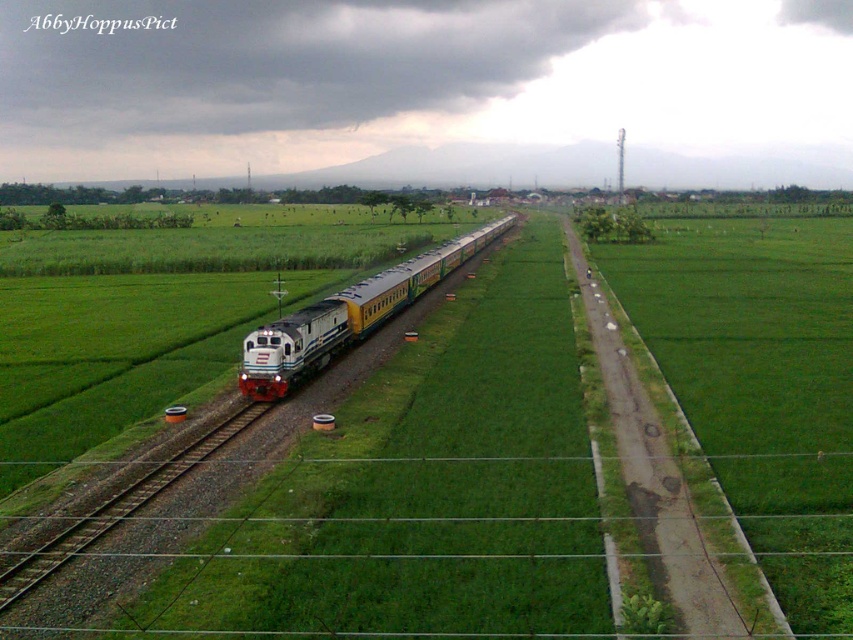
Between green grass field at center and yellow-green painted passenger train at center, which one has less height?

With less height is green grass field at center.

Consider the image. Is green grass field at center shorter than yellow-green painted passenger train at center?

Yes.

The width and height of the screenshot is (853, 640). I want to click on green grass field at center, so click(389, 493).

Who is more forward, (x=262, y=368) or (x=10, y=592)?

Point (x=10, y=592)

Is yellow-green painted passenger train at center thinner than smooth metal train track at center?

Incorrect, yellow-green painted passenger train at center's width is not less than smooth metal train track at center's.

Locate an element on the screen. The width and height of the screenshot is (853, 640). yellow-green painted passenger train at center is located at coordinates (347, 316).

Is green grass field at center shorter than smooth metal train track at center?

Incorrect, green grass field at center's height does not fall short of smooth metal train track at center's.

Can you confirm if green grass field at center is taller than smooth metal train track at center?

Indeed, green grass field at center has a greater height compared to smooth metal train track at center.

Describe the element at coordinates (389, 493) in the screenshot. Image resolution: width=853 pixels, height=640 pixels. I see `green grass field at center` at that location.

The image size is (853, 640). In order to click on green grass field at center in this screenshot , I will do `click(389, 493)`.